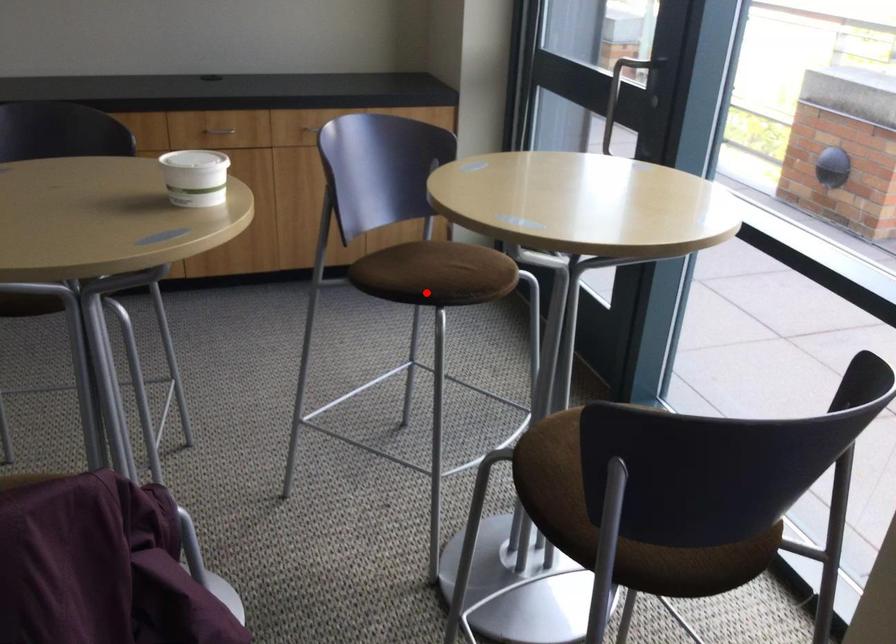
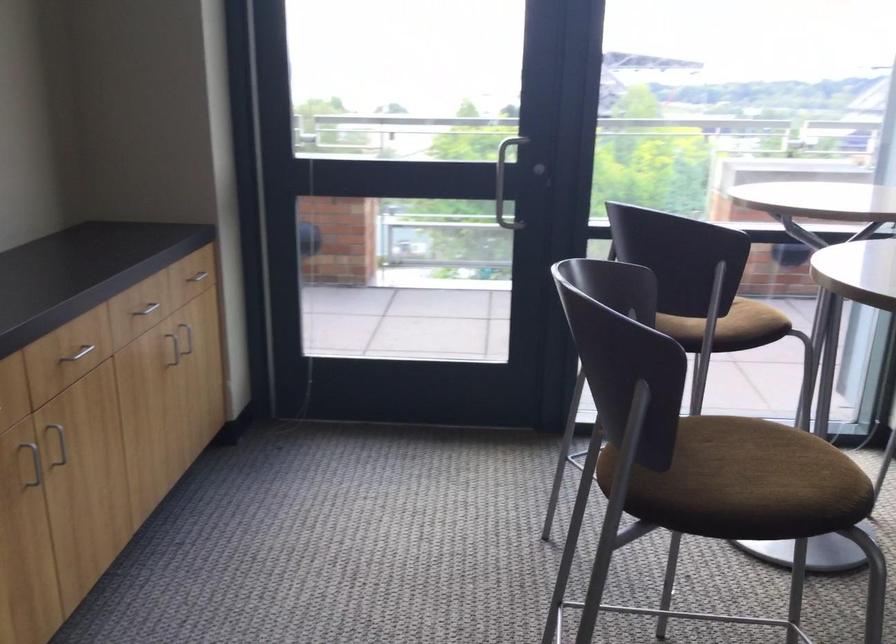
Question: I am providing you with two images of the same scene from different viewpoints. Given a red point in image1, look at the same physical point in image2. Is it:

Choices:
 (A) Closer to the viewpoint
 (B) Farther from the viewpoint

Answer: (B)